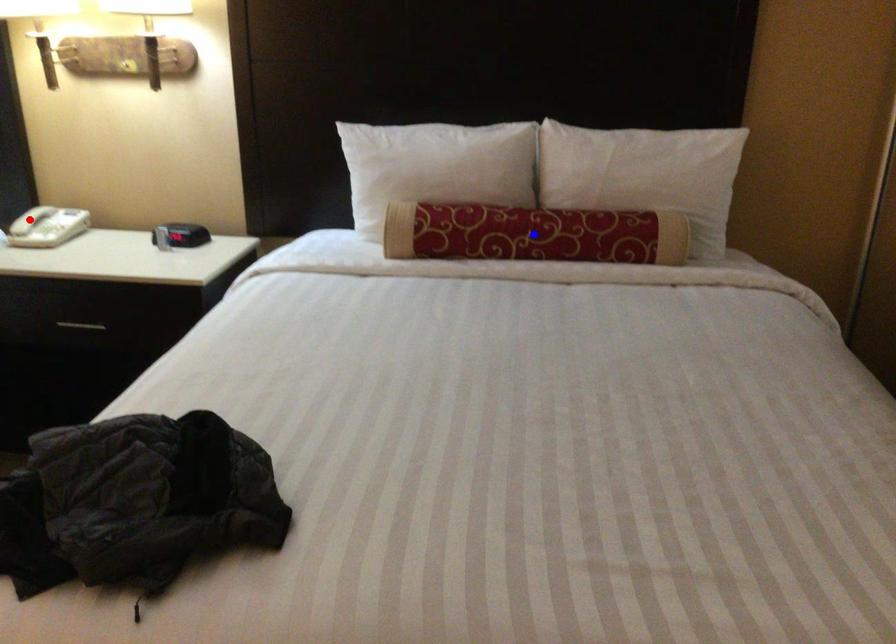
Question: Two points are marked on the image. Which point is closer to the camera?

Choices:
 (A) Blue point is closer.
 (B) Red point is closer.

Answer: (A)